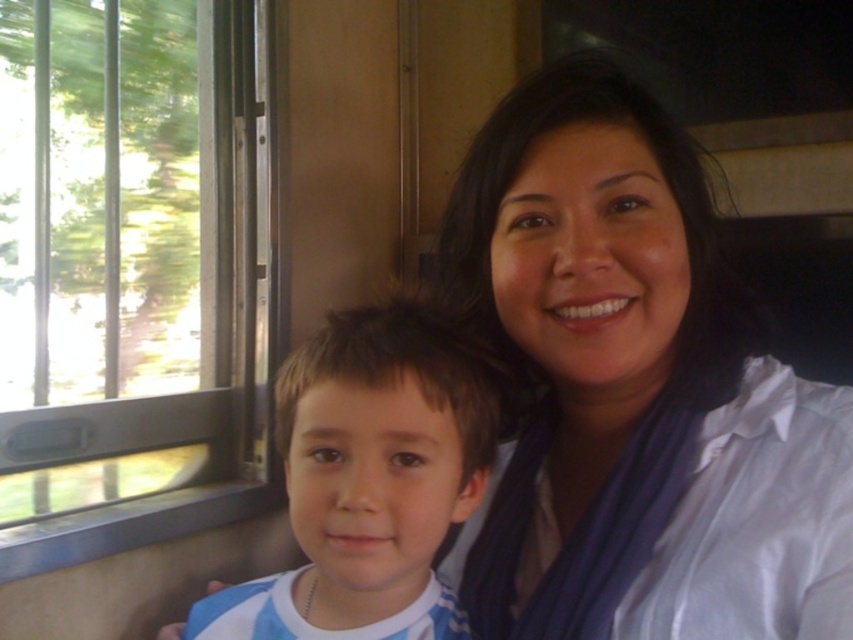
Who is taller, clear glass window at left or blue striped shirt at center?

clear glass window at left is taller.

Does clear glass window at left have a smaller size compared to blue striped shirt at center?

No.

Which is behind, point (236, 136) or point (335, 630)?

Point (236, 136)

Locate an element on the screen. clear glass window at left is located at coordinates (132, 273).

Between white satin blouse at upper right and clear glass window at left, which one appears on the left side from the viewer's perspective?

clear glass window at left is more to the left.

This screenshot has width=853, height=640. What do you see at coordinates (635, 390) in the screenshot?
I see `white satin blouse at upper right` at bounding box center [635, 390].

In order to click on white satin blouse at upper right in this screenshot , I will do `click(635, 390)`.

Who is taller, white satin blouse at upper right or blue striped shirt at center?

Standing taller between the two is white satin blouse at upper right.

Is point (692, 314) positioned in front of point (340, 456)?

No, it is behind (340, 456).

Image resolution: width=853 pixels, height=640 pixels. I want to click on white satin blouse at upper right, so click(635, 390).